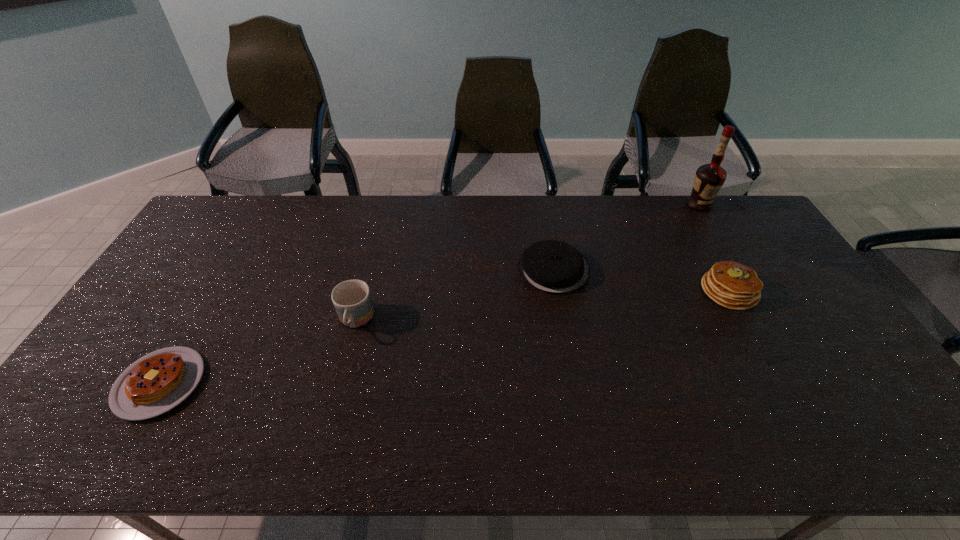
Locate an element on the screen. The image size is (960, 540). vacant space that's between the nearest object and the tallest object is located at coordinates (429, 294).

Locate an element on the screen. The height and width of the screenshot is (540, 960). vacant area that lies between the mug and the shortest object is located at coordinates (258, 352).

Identify the location of vacant area between the third object from left to right and the mug. This screenshot has width=960, height=540. (455, 295).

Find the location of a particular element. Image resolution: width=960 pixels, height=540 pixels. free space between the liquor and the tallest pancake is located at coordinates (714, 248).

Select which object is the fourth closest to the second shortest object. Please provide its 2D coordinates. Your answer should be formatted as a tuple, i.e. [(x, y)], where the tuple contains the x and y coordinates of a point satisfying the conditions above.

[(157, 382)]

Select which object is the third closest to the second object from left to right. Please provide its 2D coordinates. Your answer should be formatted as a tuple, i.e. [(x, y)], where the tuple contains the x and y coordinates of a point satisfying the conditions above.

[(730, 284)]

The image size is (960, 540). What are the coordinates of `pancake that is the second nearest to the third tallest object` in the screenshot? It's located at (157, 382).

The width and height of the screenshot is (960, 540). What are the coordinates of `pancake that is the closest to the nearest pancake` in the screenshot? It's located at (551, 266).